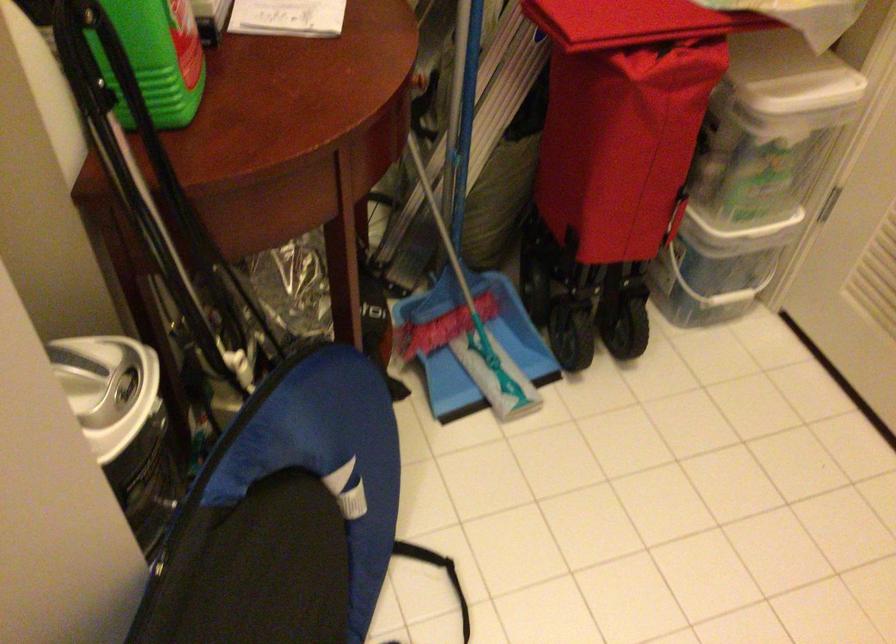
The image size is (896, 644). What do you see at coordinates (460, 71) in the screenshot?
I see `the broom handle` at bounding box center [460, 71].